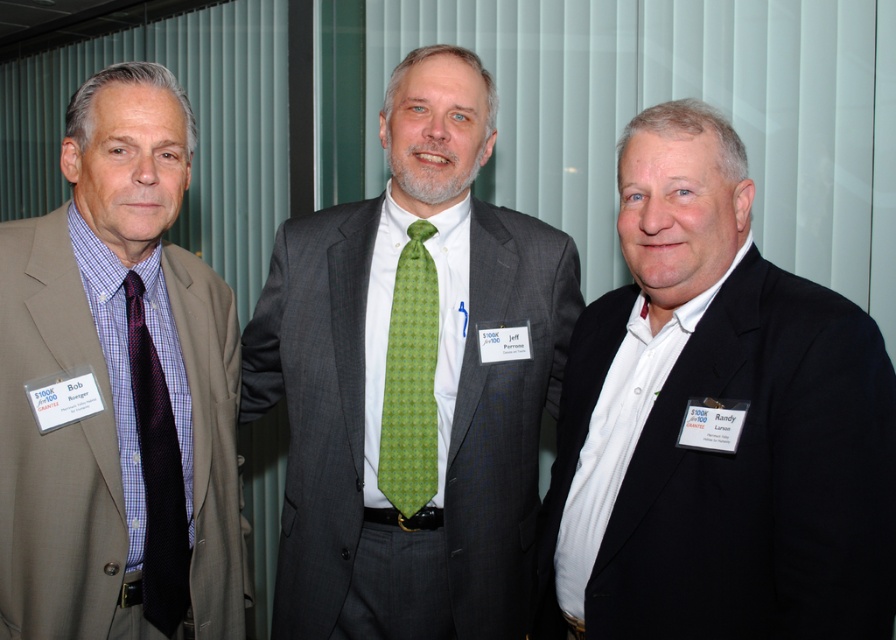
From the picture: Does white matte shirt at center appear on the right side of matte brown suit at left?

Correct, you'll find white matte shirt at center to the right of matte brown suit at left.

Which is in front, point (859, 419) or point (153, 113)?

Positioned in front is point (859, 419).

Find the location of `white matte shirt at center`. white matte shirt at center is located at coordinates (714, 422).

Which of these two, green textured tie at center or matte brown suit at left, stands shorter?

Standing shorter between the two is matte brown suit at left.

Is green textured tie at center further to camera compared to matte brown suit at left?

Yes, green textured tie at center is behind matte brown suit at left.

Is point (467, 260) farther from camera compared to point (93, 371)?

Yes.

At what (x,y) coordinates should I click in order to perform the action: click on green textured tie at center. Please return your answer as a coordinate pair (x, y). Looking at the image, I should click on (393, 378).

Is matte brown suit at left wider than green printed tie at center?

Correct, the width of matte brown suit at left exceeds that of green printed tie at center.

Is matte brown suit at left below green printed tie at center?

Actually, matte brown suit at left is above green printed tie at center.

Is point (227, 376) less distant than point (395, 394)?

No, (227, 376) is behind (395, 394).

I want to click on matte brown suit at left, so click(119, 388).